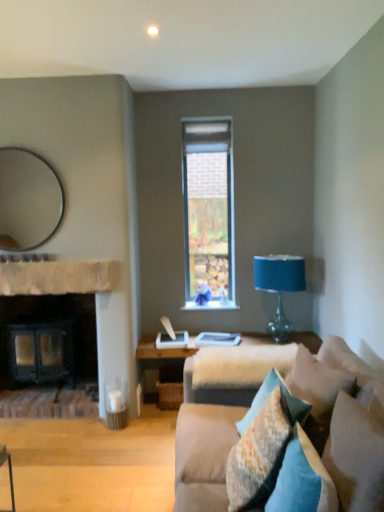
You are a GUI agent. You are given a task and a screenshot of the screen. Output one action in this format:
    pyautogui.click(x=<x>, y=<y>)
    Task: Click on the free point above matte silver mirror at upper left (from a real-world perspective)
    This screenshot has height=512, width=384.
    Given the screenshot: What is the action you would take?
    pyautogui.click(x=26, y=146)